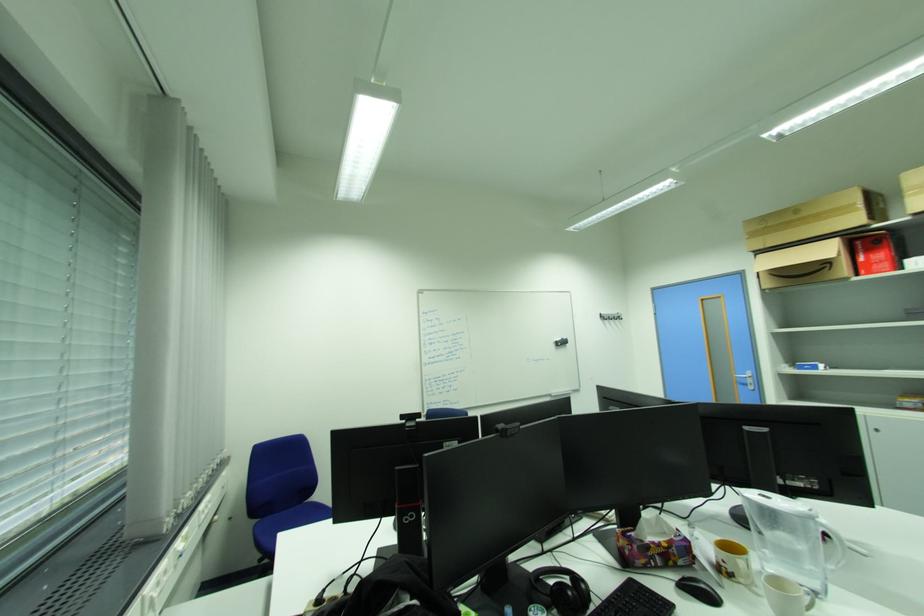
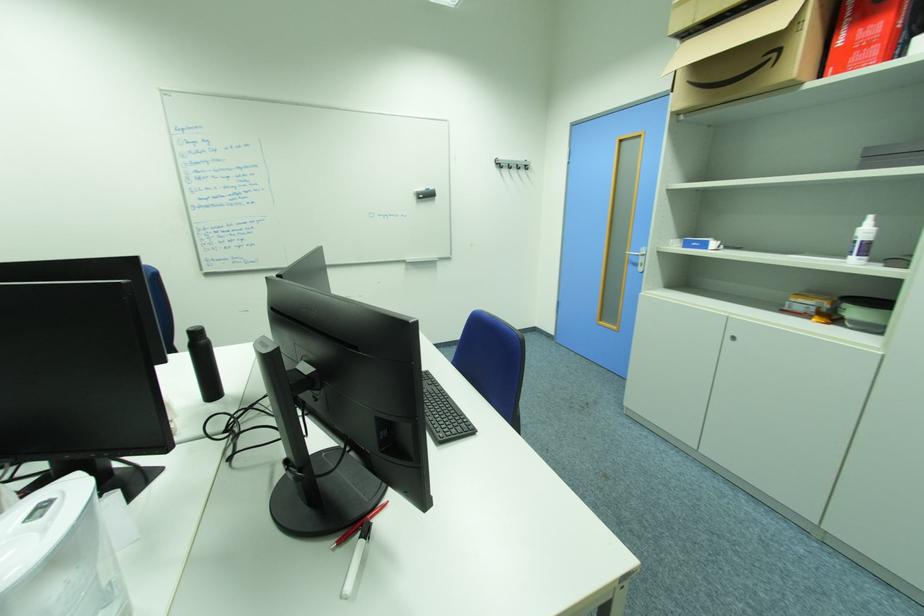
Looking at this image, what movement of the cameraman would produce the second image?

The movement direction of the cameraman is right, forward.